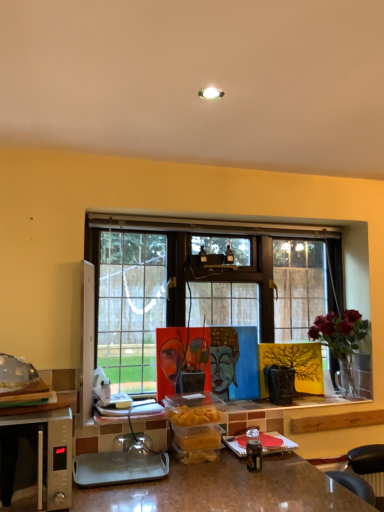
Where is `translucent glass food at left`? This screenshot has height=512, width=384. translucent glass food at left is located at coordinates (16, 374).

Locate an element on the screen. silver metallic microwave oven at lower left is located at coordinates (51, 451).

What is the approximate height of deep red flowers in glass vase at right?

It is 51.64 centimeters.

Find the location of `translucent glass food at left`. translucent glass food at left is located at coordinates (16, 374).

Which object is positioned more to the left, deep red flowers in glass vase at right or translucent glass food at left?

translucent glass food at left is more to the left.

Based on the photo, from the image's perspective, is deep red flowers in glass vase at right located beneath translucent glass food at left?

Yes.

Is deep red flowers in glass vase at right oriented towards translucent glass food at left?

No, deep red flowers in glass vase at right is not aimed at translucent glass food at left.

Based on the photo, between deep red flowers in glass vase at right and translucent glass food at left, which one has smaller width?

deep red flowers in glass vase at right is thinner.

Does silver metallic microwave oven at lower left lie in front of translucent glass food at left?

Yes, it is in front of translucent glass food at left.

Does point (7, 416) appear closer or farther from the camera than point (0, 360)?

Point (7, 416) is positioned closer to the camera compared to point (0, 360).

Is silver metallic microwave oven at lower left aimed at translucent glass food at left?

No, silver metallic microwave oven at lower left is not aimed at translucent glass food at left.

From the picture: From the image's perspective, between silver metallic microwave oven at lower left and translucent glass food at left, which one is located above?

From the image's view, translucent glass food at left is above.

In the scene shown: From a real-world perspective, does silver metallic microwave oven at lower left sit lower than deep red flowers in glass vase at right?

Yes, from a real-world perspective, silver metallic microwave oven at lower left is under deep red flowers in glass vase at right.

Considering the positions of objects silver metallic microwave oven at lower left and deep red flowers in glass vase at right in the image provided, who is behind, silver metallic microwave oven at lower left or deep red flowers in glass vase at right?

deep red flowers in glass vase at right.

From the picture: From the image's perspective, is silver metallic microwave oven at lower left above or below deep red flowers in glass vase at right?

Based on their image positions, silver metallic microwave oven at lower left is located beneath deep red flowers in glass vase at right.

Which is more to the right, silver metallic microwave oven at lower left or deep red flowers in glass vase at right?

deep red flowers in glass vase at right.

Is silver metallic microwave oven at lower left at the back of deep red flowers in glass vase at right?

That's not correct — deep red flowers in glass vase at right is not looking away from silver metallic microwave oven at lower left.

Based on the photo, is deep red flowers in glass vase at right further to the viewer compared to silver metallic microwave oven at lower left?

Yes, the depth of deep red flowers in glass vase at right is greater than that of silver metallic microwave oven at lower left.

How different are the orientations of deep red flowers in glass vase at right and silver metallic microwave oven at lower left in degrees?

deep red flowers in glass vase at right and silver metallic microwave oven at lower left are facing 0.00792 degrees away from each other.

Based on the photo, from a real-world perspective, between deep red flowers in glass vase at right and silver metallic microwave oven at lower left, who is vertically lower?

silver metallic microwave oven at lower left.

From a real-world perspective, is translucent glass food at left physically located above or below deep red flowers in glass vase at right?

From a real-world perspective, translucent glass food at left is physically above deep red flowers in glass vase at right.

Is translucent glass food at left in contact with deep red flowers in glass vase at right?

No, translucent glass food at left is not next to deep red flowers in glass vase at right.

Consider the image. Could deep red flowers in glass vase at right be considered to be inside translucent glass food at left?

No.

From the image's perspective, is translucent glass food at left above or below deep red flowers in glass vase at right?

Based on their image positions, translucent glass food at left is located above deep red flowers in glass vase at right.

In terms of height, does translucent glass food at left look taller or shorter compared to silver metallic microwave oven at lower left?

Considering their sizes, translucent glass food at left has less height than silver metallic microwave oven at lower left.

From a real-world perspective, is translucent glass food at left on silver metallic microwave oven at lower left?

Yes, from a real-world perspective, translucent glass food at left is above silver metallic microwave oven at lower left.

Is translucent glass food at left far from silver metallic microwave oven at lower left?

No, translucent glass food at left is not far from silver metallic microwave oven at lower left.

From the image's perspective, is translucent glass food at left located above or below silver metallic microwave oven at lower left?

Clearly, from the image's perspective, translucent glass food at left is above silver metallic microwave oven at lower left.

Where is `food above the deep red flowers in glass vase at right (from a real-world perspective)`? The width and height of the screenshot is (384, 512). food above the deep red flowers in glass vase at right (from a real-world perspective) is located at coordinates (16, 374).

Where is `food located behind the silver metallic microwave oven at lower left`? food located behind the silver metallic microwave oven at lower left is located at coordinates (16, 374).

Which object lies nearer to the anchor point deep red flowers in glass vase at right, silver metallic microwave oven at lower left or translucent glass food at left?

silver metallic microwave oven at lower left is closer to deep red flowers in glass vase at right.

Considering their positions, is deep red flowers in glass vase at right positioned closer to translucent glass food at left than silver metallic microwave oven at lower left?

silver metallic microwave oven at lower left.

From the image, which object appears to be nearer to silver metallic microwave oven at lower left, deep red flowers in glass vase at right or translucent glass food at left?

Result: Among the two, translucent glass food at left is located nearer to silver metallic microwave oven at lower left.

Estimate the real-world distances between objects in this image. Which object is closer to deep red flowers in glass vase at right, translucent glass food at left or silver metallic microwave oven at lower left?

Among the two, silver metallic microwave oven at lower left is located nearer to deep red flowers in glass vase at right.

Considering their positions, is translucent glass food at left positioned further to silver metallic microwave oven at lower left than deep red flowers in glass vase at right?

deep red flowers in glass vase at right is positioned further to the anchor silver metallic microwave oven at lower left.

Which object lies nearer to the anchor point translucent glass food at left, silver metallic microwave oven at lower left or deep red flowers in glass vase at right?

Among the two, silver metallic microwave oven at lower left is located nearer to translucent glass food at left.

At what (x,y) coordinates should I click in order to perform the action: click on microwave oven located between translucent glass food at left and deep red flowers in glass vase at right in the left-right direction. Please return your answer as a coordinate pair (x, y). The height and width of the screenshot is (512, 384). Looking at the image, I should click on (51, 451).